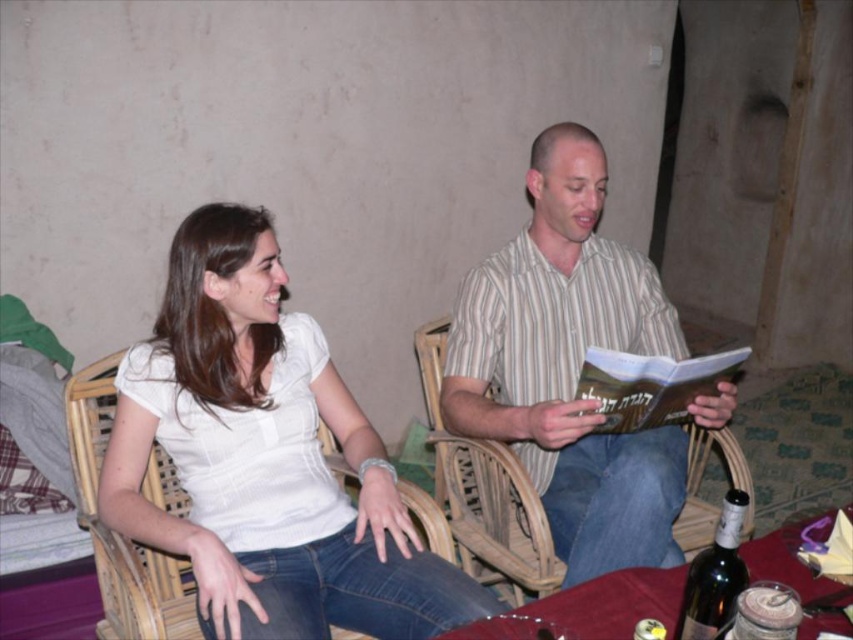
Question: Which is nearer to the hardcover book at center?

Choices:
 (A) white matte shirt at upper left
 (B) dark green glass bottle at lower right
 (C) striped cotton shirt at center

Answer: (C)

Question: Is white matte shirt at upper left thinner than hardcover book at center?

Choices:
 (A) no
 (B) yes

Answer: (A)

Question: Which object appears farthest from the camera in this image?

Choices:
 (A) striped cotton shirt at center
 (B) dark green glass bottle at lower right
 (C) hardcover book at center
 (D) white matte shirt at upper left

Answer: (C)

Question: Does white matte shirt at upper left appear on the left side of dark green glass bottle at lower right?

Choices:
 (A) yes
 (B) no

Answer: (A)

Question: Is striped cotton shirt at center to the right of hardcover book at center from the viewer's perspective?

Choices:
 (A) no
 (B) yes

Answer: (A)

Question: Which object appears closest to the camera in this image?

Choices:
 (A) striped cotton shirt at center
 (B) hardcover book at center

Answer: (A)